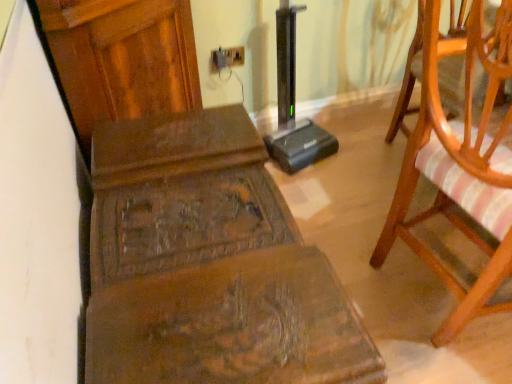
Question: Relative to wooden carved bench at center, is matte plastic electric outlet at upper center in front or behind?

Choices:
 (A) front
 (B) behind

Answer: (B)

Question: From the image's perspective, is matte plastic electric outlet at upper center located above or below wooden carved bench at center?

Choices:
 (A) above
 (B) below

Answer: (A)

Question: Which is nearer to the matte plastic electric outlet at upper center?

Choices:
 (A) wooden chair with striped cushion at right
 (B) wooden carved bench at center

Answer: (B)

Question: Which object is positioned farthest from the matte plastic electric outlet at upper center?

Choices:
 (A) wooden chair with striped cushion at right
 (B) wooden carved bench at center

Answer: (A)